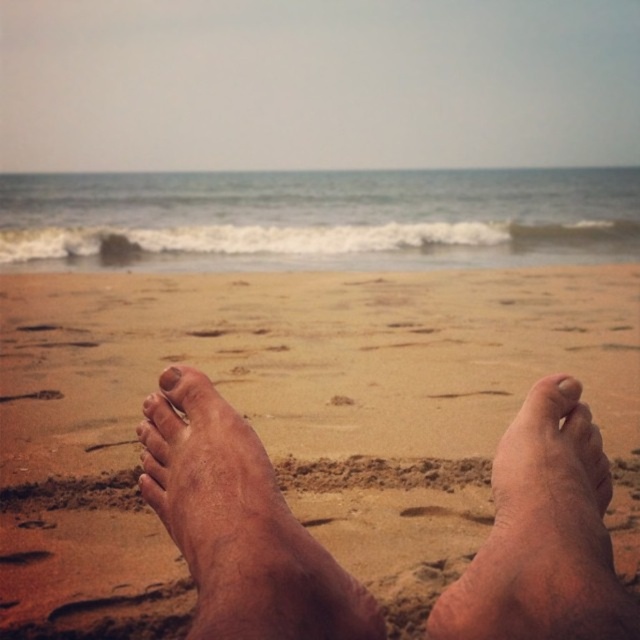
You are lying on the beach and notice your feet. Which part of your feet is higher up when looking at the brown rough skin at center and the pink matte toe at center?

The brown rough skin at center is higher than the pink matte toe at center.

You are lying on the beach and want to check if your pink matte toe at center is fully visible above the brown sandy feet at center. Based on the scene, can you confirm this?

The brown sandy feet at center is taller than pink matte toe at center, so the pink matte toe at center is not fully visible above the brown sandy feet at center.